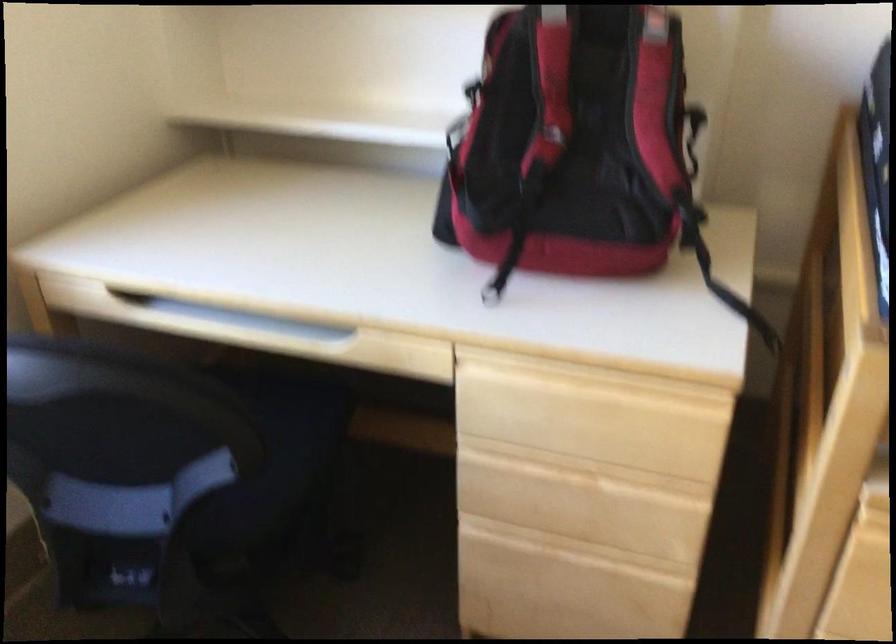
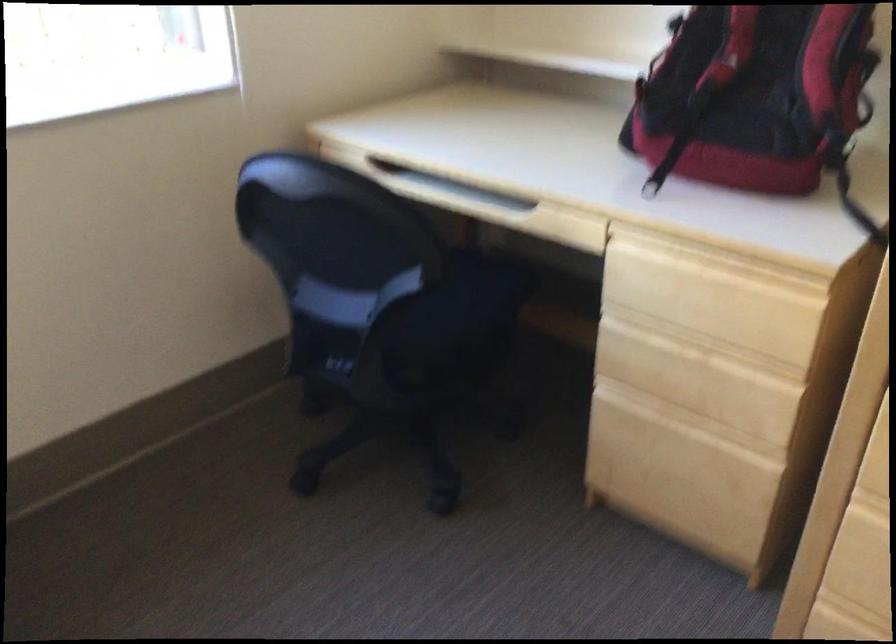
The images are taken continuously from a first-person perspective. In which direction are you moving?

The movement direction of the cameraman is right, backward.